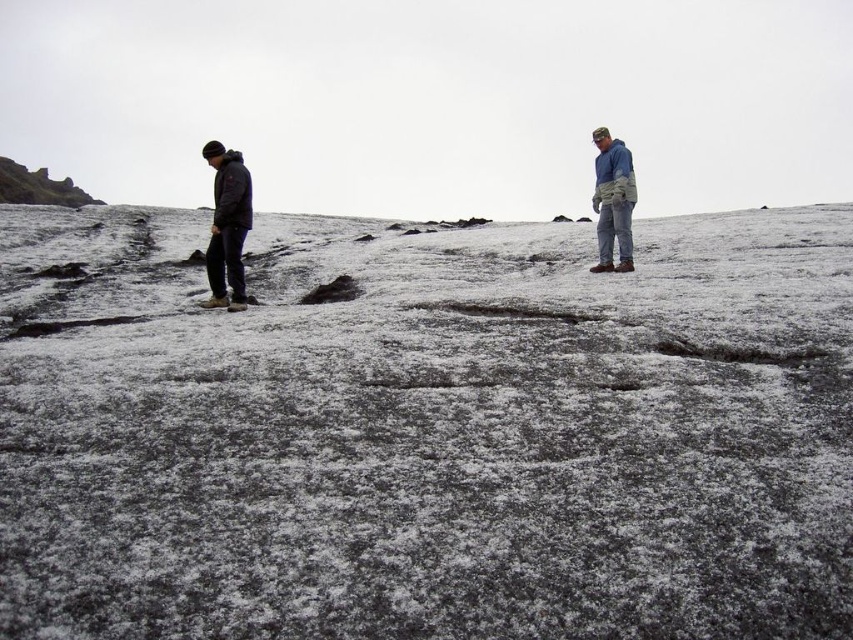
Between white textured snow at center and matte black jacket at left, which one has more height?

Standing taller between the two is white textured snow at center.

Who is more distant from viewer, (196, 500) or (236, 253)?

The point (236, 253) is more distant.

Locate an element on the screen. white textured snow at center is located at coordinates (426, 429).

Does matte black jacket at left have a larger size compared to blue fleece jacket at right?

No.

Is point (236, 273) more distant than point (601, 192)?

No, it is in front of (601, 192).

You are a GUI agent. You are given a task and a screenshot of the screen. Output one action in this format:
    pyautogui.click(x=<x>, y=<y>)
    Task: Click on the matte black jacket at left
    This screenshot has width=853, height=640.
    Given the screenshot: What is the action you would take?
    pyautogui.click(x=227, y=227)

Who is positioned more to the left, white textured snow at center or rugged stone cliff at upper left?

rugged stone cliff at upper left is more to the left.

The height and width of the screenshot is (640, 853). I want to click on white textured snow at center, so click(426, 429).